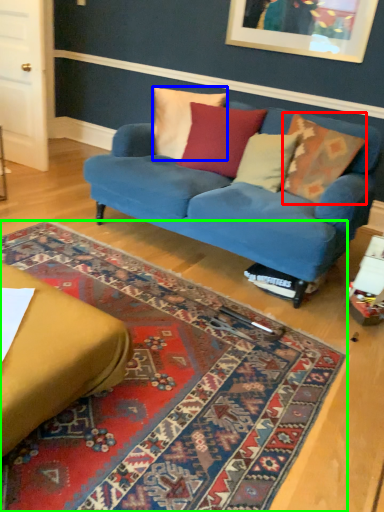
Question: Which object is the closest to the pillow (highlighted by a red box)? Choose among these: pillow (highlighted by a blue box) or mat (highlighted by a green box).

Choices:
 (A) pillow
 (B) mat

Answer: (A)